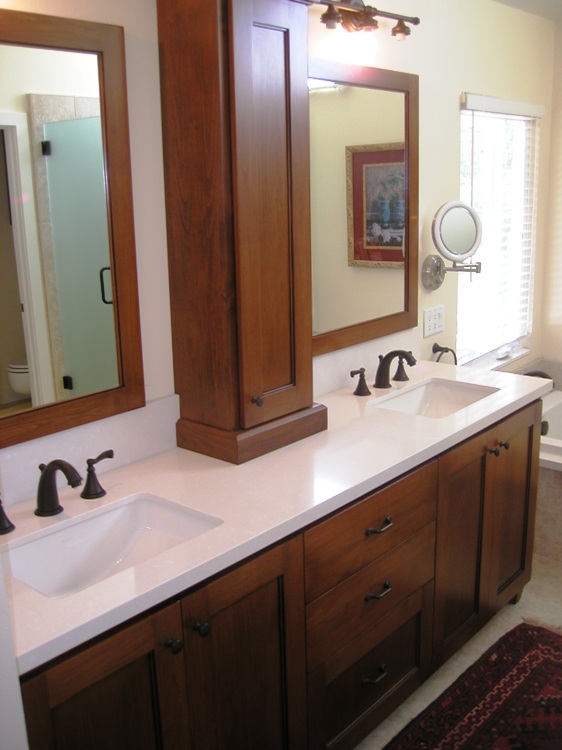
Identify the location of faucet handles. The width and height of the screenshot is (562, 750). (364, 379), (4, 524), (92, 481), (401, 375).